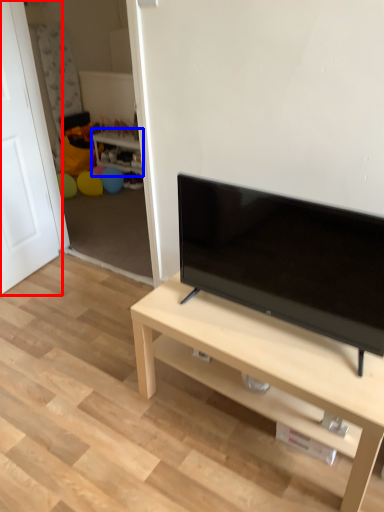
Question: Which point is closer to the camera, door (highlighted by a red box) or side table (highlighted by a blue box)?

Choices:
 (A) door
 (B) side table

Answer: (A)